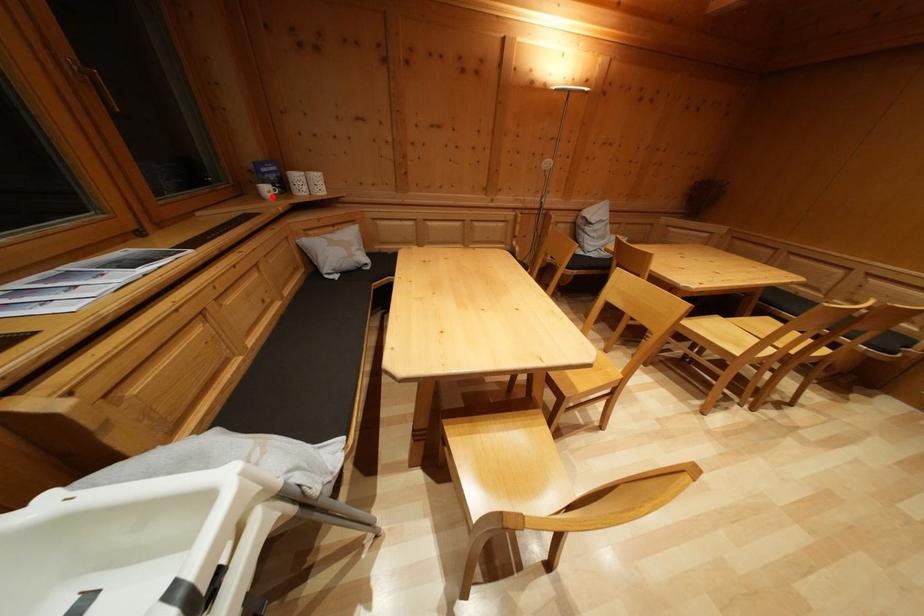
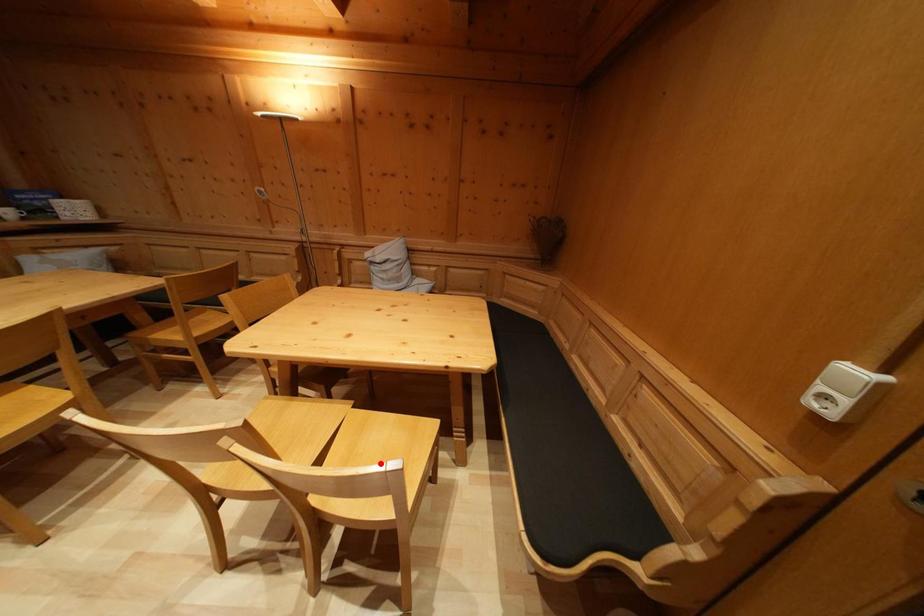
I am providing you with two images of the same scene from different viewpoints. A red point is marked on the first image and another point is marked on the second image. Is the red point in image1 aligned with the point shown in image2?

No